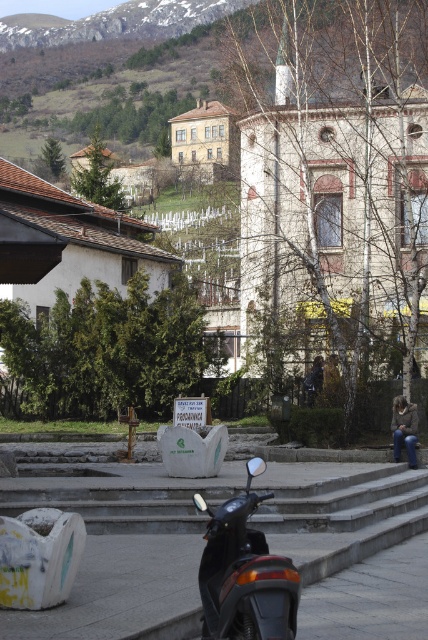
Is point (252, 618) positioned after point (400, 445)?

No, it is in front of (400, 445).

This screenshot has width=428, height=640. Find the location of `black matte scooter at lower center`. black matte scooter at lower center is located at coordinates (243, 573).

Where is `black matte scooter at lower center`? black matte scooter at lower center is located at coordinates (243, 573).